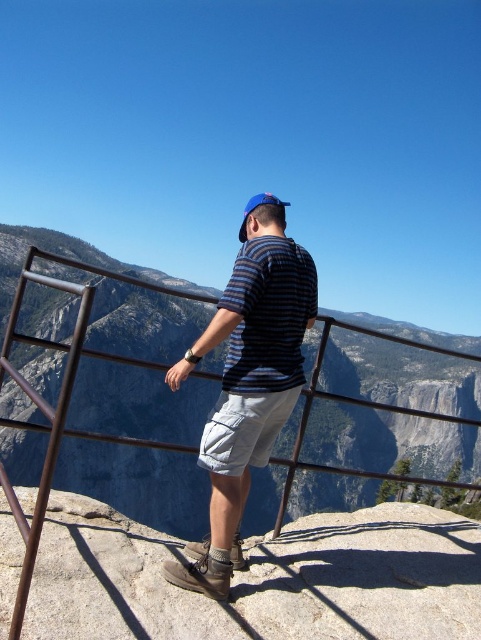
Question: Observing the image, what is the correct spatial positioning of gray rock formation at center in reference to blue fabric baseball cap at upper center?

Choices:
 (A) above
 (B) below

Answer: (B)

Question: Is the position of gray rock formation at center less distant than that of striped fabric shirt at center?

Choices:
 (A) yes
 (B) no

Answer: (A)

Question: Which object appears closest to the camera in this image?

Choices:
 (A) white cotton shorts at center
 (B) gray rock formation at center
 (C) blue fabric baseball cap at upper center

Answer: (B)

Question: Which object is the farthest from the gray/rough rock at center?

Choices:
 (A) striped fabric shirt at center
 (B) blue fabric baseball cap at upper center
 (C) white cotton shorts at center

Answer: (B)

Question: Which of the following is the closest to the observer?

Choices:
 (A) (233, 417)
 (B) (281, 352)
 (C) (278, 202)
 (D) (465, 346)

Answer: (A)

Question: Can you confirm if white cotton shorts at center is bigger than blue fabric baseball cap at upper center?

Choices:
 (A) yes
 (B) no

Answer: (B)